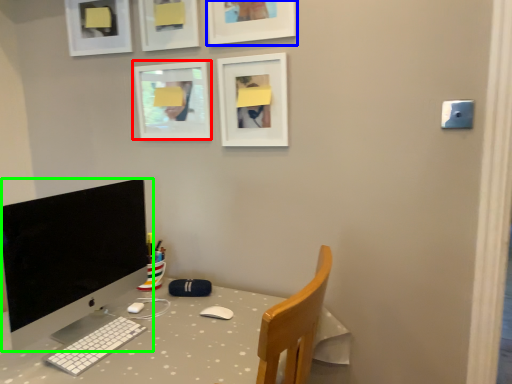
Question: Which object is the farthest from picture frame (highlighted by a red box)? Choose among these: picture frame (highlighted by a blue box) or computer monitor (highlighted by a green box).

Choices:
 (A) picture frame
 (B) computer monitor

Answer: (B)